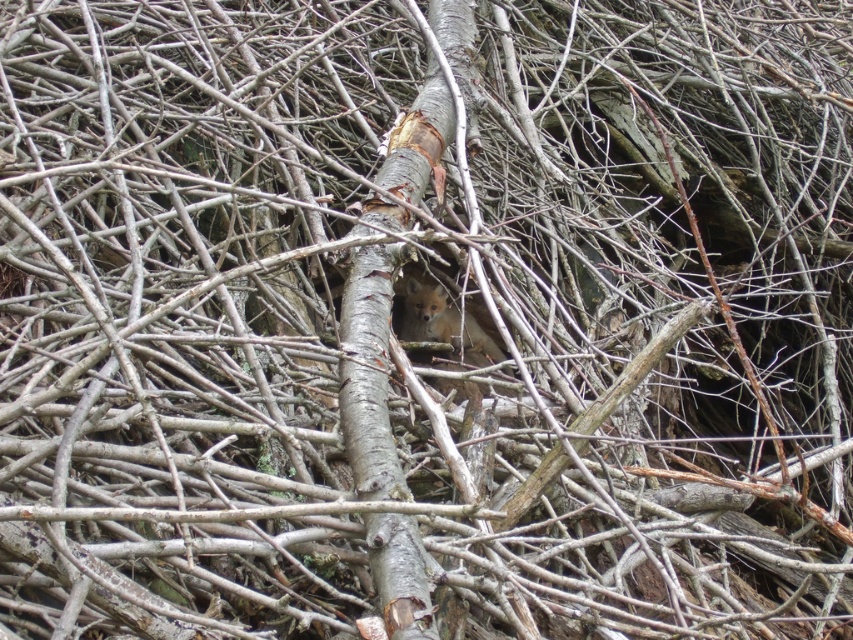
Consider the image. You are navigating through the dense tangle of branches and twigs in the image. You are currently at point [405,156] and want to reach point [401,296]. Based on the spatial relationship between these two points, which direction should you move to get closer to your destination?

To move from point [405,156] to point [401,296], you should move to the right since point [401,296] is located to the right of point [405,156].

You are navigating through a dense forest and come across a tangle of intertwined branches. You need to locate the gray bark tree trunk at center to mark your position. Based on the coordinates provided, can you determine its exact position in the scene?

The gray bark tree trunk at center is located at point (369, 371), which marks its exact position in the scene.